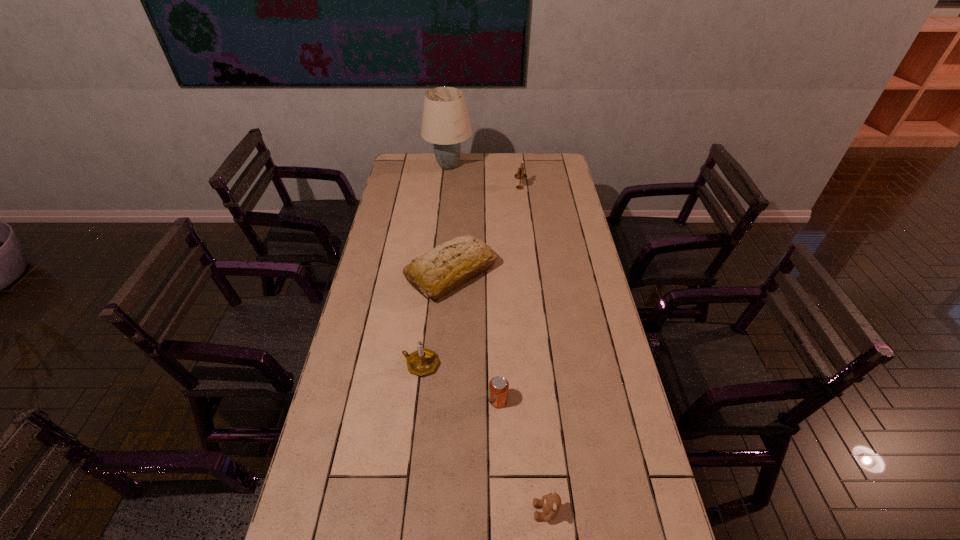
Find the location of a particular element. Image resolution: width=960 pixels, height=540 pixels. lampshade is located at coordinates (445, 122).

What are the coordinates of `the farthest object` in the screenshot? It's located at (445, 122).

Locate an element on the screen. Image resolution: width=960 pixels, height=540 pixels. the fifth nearest object is located at coordinates (520, 175).

Where is `the farther candle holder`? The height and width of the screenshot is (540, 960). the farther candle holder is located at coordinates (520, 175).

Find the location of a particular element. Image resolution: width=960 pixels, height=540 pixels. bread is located at coordinates (448, 266).

Identify the location of the third nearest object. (423, 361).

Where is `the left candle holder`? the left candle holder is located at coordinates (423, 361).

Locate an element on the screen. This screenshot has width=960, height=540. can is located at coordinates (498, 386).

Locate an element on the screen. The width and height of the screenshot is (960, 540). the nearest object is located at coordinates (550, 503).

At what (x,y) coordinates should I click in order to perform the action: click on vacant region located 0.380m on the front of the farthest object. Please return your answer as a coordinate pair (x, y). Image resolution: width=960 pixels, height=540 pixels. Looking at the image, I should click on (443, 226).